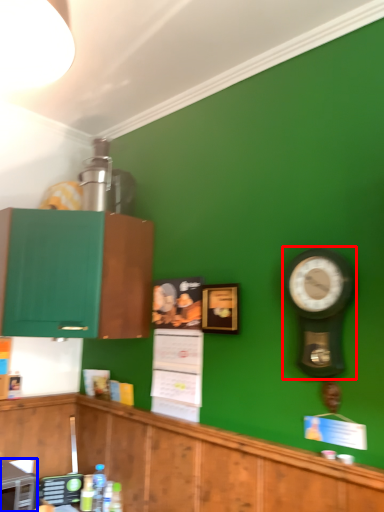
Question: Which of the following is the farthest to the observer, clock (highlighted by a red box) or appliance (highlighted by a blue box)?

Choices:
 (A) clock
 (B) appliance

Answer: (B)